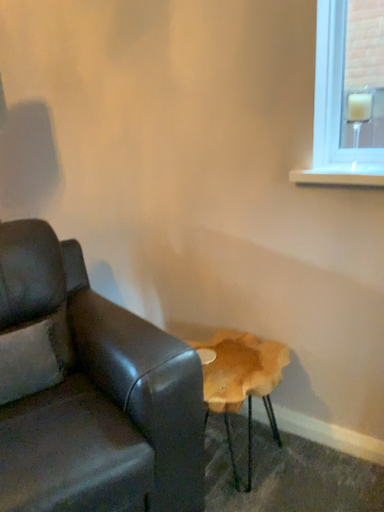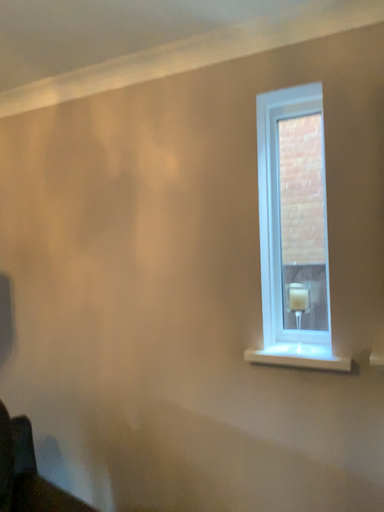
Question: Which way did the camera rotate in the video?

Choices:
 (A) rotated left
 (B) rotated right

Answer: (B)